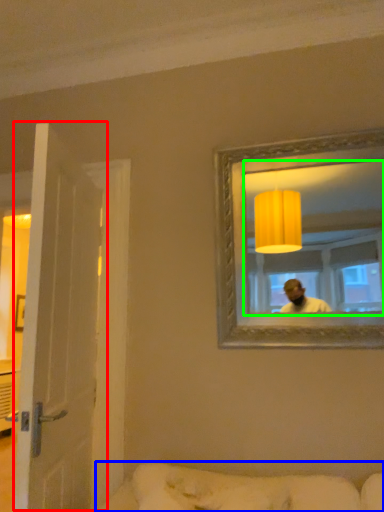
Question: Which is nearer to the door (highlighted by a red box)? studio couch (highlighted by a blue box) or mirror (highlighted by a green box).

Choices:
 (A) studio couch
 (B) mirror

Answer: (A)